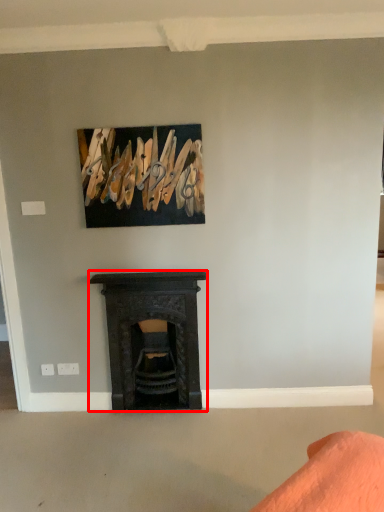
Question: Observing the image, what is the correct spatial positioning of fireplace (annotated by the red box) in reference to picture frame?

Choices:
 (A) left
 (B) right

Answer: (B)